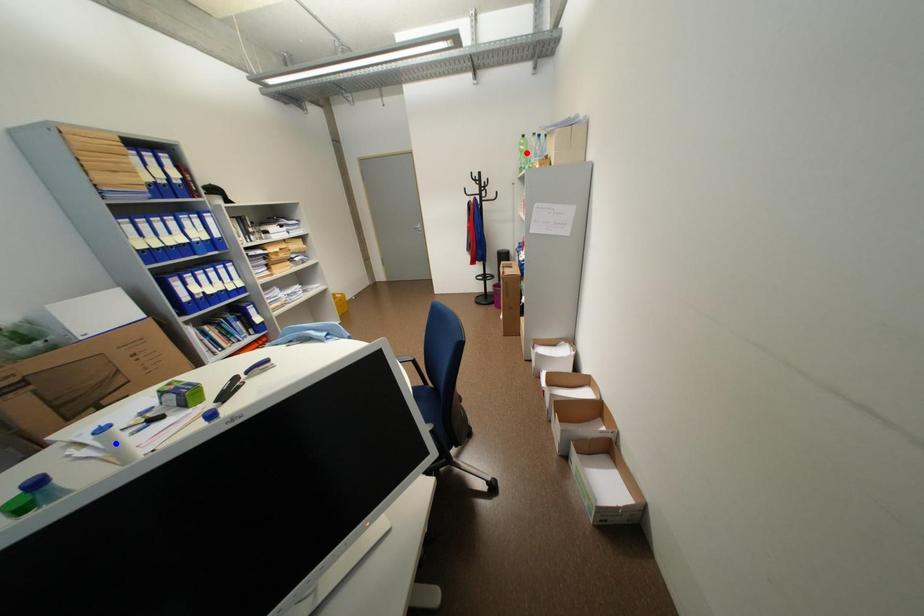
Question: Which of the two points in the image is closer to the camera?

Choices:
 (A) Blue point is closer.
 (B) Red point is closer.

Answer: (A)